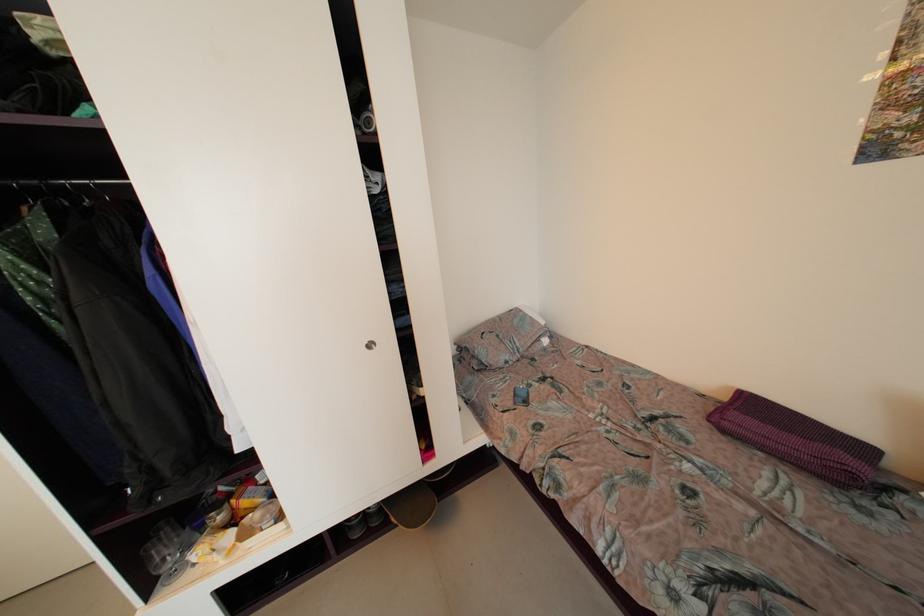
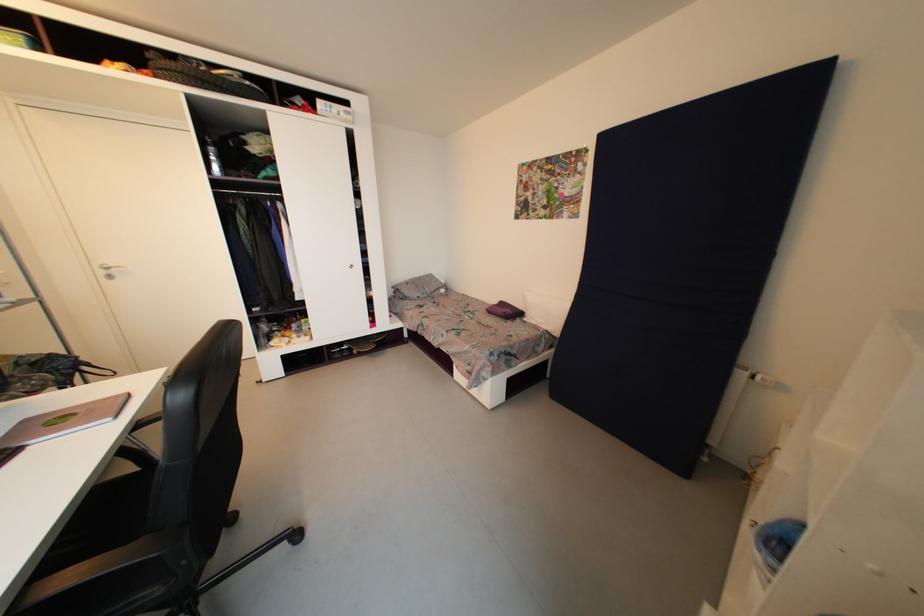
Question: The images are taken continuously from a first-person perspective. In which direction are you moving?

Choices:
 (A) Left
 (B) Right
 (C) Forward
 (D) Backward

Answer: (D)